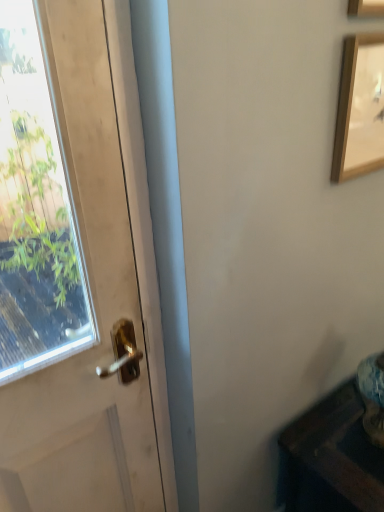
Locate an element on the screen. wooden picture frame at upper right, acting as the first picture frame starting from the top is located at coordinates click(366, 8).

Based on the photo, are wooden table at lower right and white matte door at left located far from each other?

Absolutely, wooden table at lower right is distant from white matte door at left.

From the image's perspective, which one is positioned lower, wooden table at lower right or white matte door at left?

wooden table at lower right is shown below in the image.

Is white matte door at left at the back of wooden table at lower right?

No.

From a real-world perspective, is wooden table at lower right physically below white matte door at left?

Yes, from a real-world perspective, wooden table at lower right is below white matte door at left.

From their relative heights in the image, would you say wooden picture frame at upper right, the second picture frame viewed from the top, is taller or shorter than white matte door at left?

Clearly, wooden picture frame at upper right, the second picture frame viewed from the top, is shorter compared to white matte door at left.

Looking at the image, does wooden picture frame at upper right, the second picture frame viewed from the top, seem bigger or smaller compared to white matte door at left?

Considering their sizes, wooden picture frame at upper right, the second picture frame viewed from the top, takes up less space than white matte door at left.

Considering the relative sizes of wooden picture frame at upper right, the second picture frame viewed from the top, and white matte door at left in the image provided, is wooden picture frame at upper right, the second picture frame viewed from the top, thinner than white matte door at left?

In fact, wooden picture frame at upper right, the second picture frame viewed from the top, might be wider than white matte door at left.

Is wooden picture frame at upper right, the 2th picture frame positioned from the bottom, located outside wooden picture frame at upper right, which appears as the first picture frame when ordered from the bottom?

Yes, wooden picture frame at upper right, the 2th picture frame positioned from the bottom, is outside of wooden picture frame at upper right, which appears as the first picture frame when ordered from the bottom.

Considering the sizes of wooden picture frame at upper right, the 2th picture frame positioned from the bottom, and wooden picture frame at upper right, the second picture frame viewed from the top, in the image, is wooden picture frame at upper right, the 2th picture frame positioned from the bottom, wider or thinner than wooden picture frame at upper right, the second picture frame viewed from the top,?

In the image, wooden picture frame at upper right, the 2th picture frame positioned from the bottom, appears to be wider than wooden picture frame at upper right, the second picture frame viewed from the top.

From a real-world perspective, between wooden picture frame at upper right, the 2th picture frame positioned from the bottom, and wooden picture frame at upper right, the second picture frame viewed from the top, who is vertically lower?

wooden picture frame at upper right, the second picture frame viewed from the top.

Considering their positions, is wooden picture frame at upper right, acting as the first picture frame starting from the top, located in front of or behind wooden picture frame at upper right, the second picture frame viewed from the top?

wooden picture frame at upper right, acting as the first picture frame starting from the top, is in front of wooden picture frame at upper right, the second picture frame viewed from the top.

From the image's perspective, is wooden picture frame at upper right, acting as the first picture frame starting from the top, under wooden table at lower right?

No, from the image's perspective, wooden picture frame at upper right, acting as the first picture frame starting from the top, is not below wooden table at lower right.

Which object is positioned more to the left, wooden picture frame at upper right, the 2th picture frame positioned from the bottom, or wooden table at lower right?

wooden picture frame at upper right, the 2th picture frame positioned from the bottom.

Considering the sizes of objects wooden picture frame at upper right, acting as the first picture frame starting from the top, and wooden table at lower right in the image provided, who is taller, wooden picture frame at upper right, acting as the first picture frame starting from the top, or wooden table at lower right?

With more height is wooden table at lower right.

Is wooden picture frame at upper right, the 2th picture frame positioned from the bottom, turned away from wooden table at lower right?

No, wooden table at lower right is not at the back of wooden picture frame at upper right, the 2th picture frame positioned from the bottom.

Is white matte door at left positioned in front of wooden table at lower right?

Yes, white matte door at left is closer to the viewer.

Find the location of `door above the wooden table at lower right (from a real-world perspective)`. door above the wooden table at lower right (from a real-world perspective) is located at coordinates (69, 269).

How many degrees apart are the facing directions of white matte door at left and wooden table at lower right?

There is a 0.0192-degree angle between the facing directions of white matte door at left and wooden table at lower right.

Does point (76, 74) come closer to viewer compared to point (323, 498)?

That is True.

Is wooden table at lower right facing towards wooden picture frame at upper right, acting as the first picture frame starting from the top?

No, wooden table at lower right does not turn towards wooden picture frame at upper right, acting as the first picture frame starting from the top.

How far apart are wooden table at lower right and wooden picture frame at upper right, the 2th picture frame positioned from the bottom?

wooden table at lower right and wooden picture frame at upper right, the 2th picture frame positioned from the bottom, are 3.34 feet apart from each other.

Where is `furniture located behind the wooden picture frame at upper right, the 2th picture frame positioned from the bottom`? This screenshot has height=512, width=384. furniture located behind the wooden picture frame at upper right, the 2th picture frame positioned from the bottom is located at coordinates coord(332,457).

Can you confirm if wooden table at lower right is taller than wooden picture frame at upper right, the 2th picture frame positioned from the bottom?

Correct, wooden table at lower right is much taller as wooden picture frame at upper right, the 2th picture frame positioned from the bottom.

Find the location of a particular element. the 1st picture frame positioned above the wooden table at lower right (from a real-world perspective) is located at coordinates (360, 109).

Which object is closer to the camera taking this photo, wooden picture frame at upper right, which appears as the first picture frame when ordered from the bottom, or wooden table at lower right?

wooden picture frame at upper right, which appears as the first picture frame when ordered from the bottom.

Which object is positioned more to the right, wooden picture frame at upper right, which appears as the first picture frame when ordered from the bottom, or wooden table at lower right?

wooden table at lower right is more to the right.

From a real-world perspective, is wooden picture frame at upper right, which appears as the first picture frame when ordered from the bottom, located beneath wooden table at lower right?

No, from a real-world perspective, wooden picture frame at upper right, which appears as the first picture frame when ordered from the bottom, is not below wooden table at lower right.

You are a GUI agent. You are given a task and a screenshot of the screen. Output one action in this format:
    pyautogui.click(x=<x>, y=<y>)
    Task: Click on the furniture on the right of white matte door at left
    The image size is (384, 512).
    Given the screenshot: What is the action you would take?
    pyautogui.click(x=332, y=457)

You are a GUI agent. You are given a task and a screenshot of the screen. Output one action in this format:
    pyautogui.click(x=<x>, y=<y>)
    Task: Click on the door located on the left of wooden picture frame at upper right, which appears as the first picture frame when ordered from the bottom
    This screenshot has height=512, width=384.
    Given the screenshot: What is the action you would take?
    pyautogui.click(x=69, y=269)

From the image, which object appears to be nearer to wooden picture frame at upper right, the 2th picture frame positioned from the bottom, white matte door at left or wooden picture frame at upper right, the second picture frame viewed from the top?

The object closer to wooden picture frame at upper right, the 2th picture frame positioned from the bottom, is wooden picture frame at upper right, the second picture frame viewed from the top.

Looking at this image, estimate the real-world distances between objects in this image. Which object is further from wooden picture frame at upper right, the 2th picture frame positioned from the bottom, wooden table at lower right or white matte door at left?

white matte door at left.

Based on their spatial positions, is wooden picture frame at upper right, which appears as the first picture frame when ordered from the bottom, or wooden table at lower right further from wooden picture frame at upper right, acting as the first picture frame starting from the top?

wooden table at lower right lies further to wooden picture frame at upper right, acting as the first picture frame starting from the top, than the other object.

From the picture: Which object lies further to the anchor point white matte door at left, wooden picture frame at upper right, which appears as the first picture frame when ordered from the bottom, or wooden table at lower right?

Based on the image, wooden picture frame at upper right, which appears as the first picture frame when ordered from the bottom, appears to be further to white matte door at left.

Looking at the image, which one is located closer to wooden table at lower right, wooden picture frame at upper right, the 2th picture frame positioned from the bottom, or wooden picture frame at upper right, which appears as the first picture frame when ordered from the bottom?

wooden picture frame at upper right, which appears as the first picture frame when ordered from the bottom.

From the image, which object appears to be nearer to wooden table at lower right, wooden picture frame at upper right, the second picture frame viewed from the top, or wooden picture frame at upper right, the 2th picture frame positioned from the bottom?

wooden picture frame at upper right, the second picture frame viewed from the top.

When comparing their distances from wooden picture frame at upper right, which appears as the first picture frame when ordered from the bottom, does wooden table at lower right or wooden picture frame at upper right, the 2th picture frame positioned from the bottom, seem closer?

Based on the image, wooden picture frame at upper right, the 2th picture frame positioned from the bottom, appears to be nearer to wooden picture frame at upper right, which appears as the first picture frame when ordered from the bottom.

In the scene shown: From the image, which object appears to be nearer to wooden picture frame at upper right, the 2th picture frame positioned from the bottom, wooden table at lower right or wooden picture frame at upper right, which appears as the first picture frame when ordered from the bottom?

wooden picture frame at upper right, which appears as the first picture frame when ordered from the bottom, lies closer to wooden picture frame at upper right, the 2th picture frame positioned from the bottom, than the other object.

Find the location of a particular element. door between wooden picture frame at upper right, acting as the first picture frame starting from the top, and wooden table at lower right in the up-down direction is located at coordinates (69, 269).

Identify the location of picture frame that lies between wooden picture frame at upper right, the 2th picture frame positioned from the bottom, and wooden table at lower right from top to bottom. (360, 109).

The height and width of the screenshot is (512, 384). I want to click on door that lies between wooden picture frame at upper right, the second picture frame viewed from the top, and wooden table at lower right from top to bottom, so click(69, 269).

This screenshot has height=512, width=384. I want to click on picture frame between wooden picture frame at upper right, acting as the first picture frame starting from the top, and white matte door at left from top to bottom, so click(x=360, y=109).